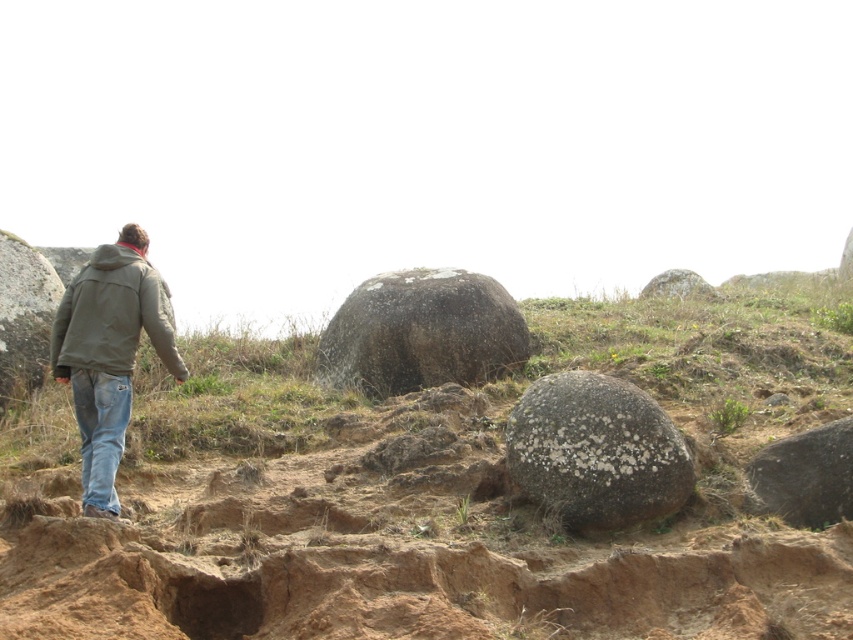
In the scene shown: Between rough stone boulder at center and smooth gray rock at left, which one appears on the right side from the viewer's perspective?

rough stone boulder at center is more to the right.

Looking at this image, does rough stone boulder at center have a greater height compared to smooth gray rock at left?

No, rough stone boulder at center is not taller than smooth gray rock at left.

Measure the distance between point [283,625] and camera.

They are 4.72 meters apart.

I want to click on rough stone boulder at center, so click(x=431, y=493).

Does speckled rock at center have a larger size compared to gray speckled rock at upper right?

Yes.

Is speckled rock at center smaller than gray speckled rock at upper right?

Incorrect, speckled rock at center is not smaller in size than gray speckled rock at upper right.

Locate an element on the screen. This screenshot has height=640, width=853. speckled rock at center is located at coordinates (422, 332).

Can you confirm if speckled gray rock at center is positioned above gray speckled rock at upper right?

No, speckled gray rock at center is not above gray speckled rock at upper right.

Does speckled gray rock at center appear under gray speckled rock at upper right?

Yes.

Image resolution: width=853 pixels, height=640 pixels. Describe the element at coordinates (596, 451) in the screenshot. I see `speckled gray rock at center` at that location.

Locate an element on the screen. Image resolution: width=853 pixels, height=640 pixels. speckled gray rock at center is located at coordinates (596, 451).